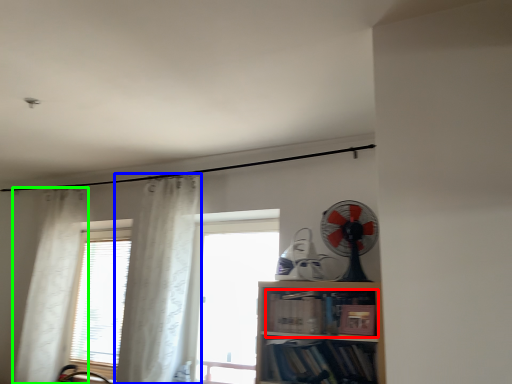
Question: Which object is the closest to the book (highlighted by a red box)? Choose among these: curtain (highlighted by a blue box) or curtain (highlighted by a green box).

Choices:
 (A) curtain
 (B) curtain

Answer: (A)